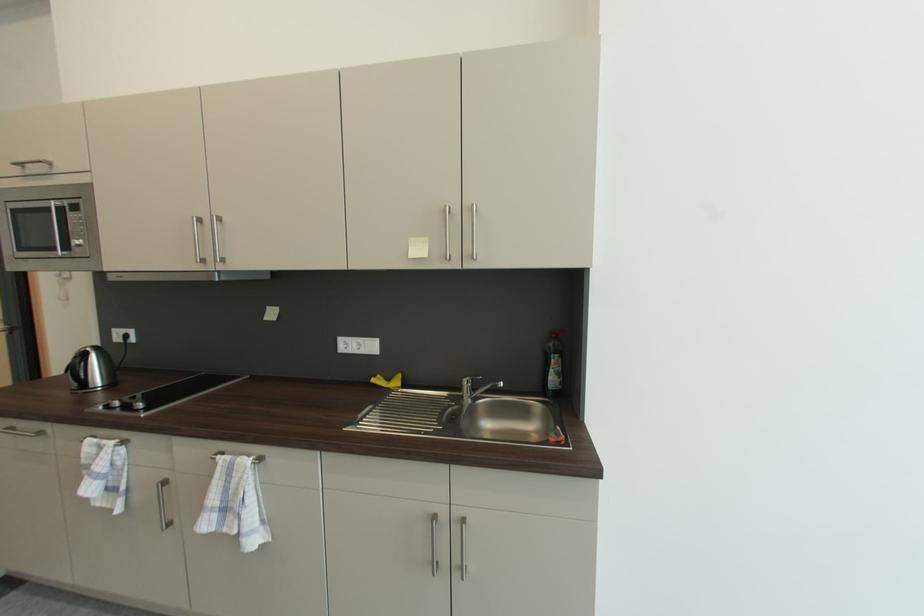
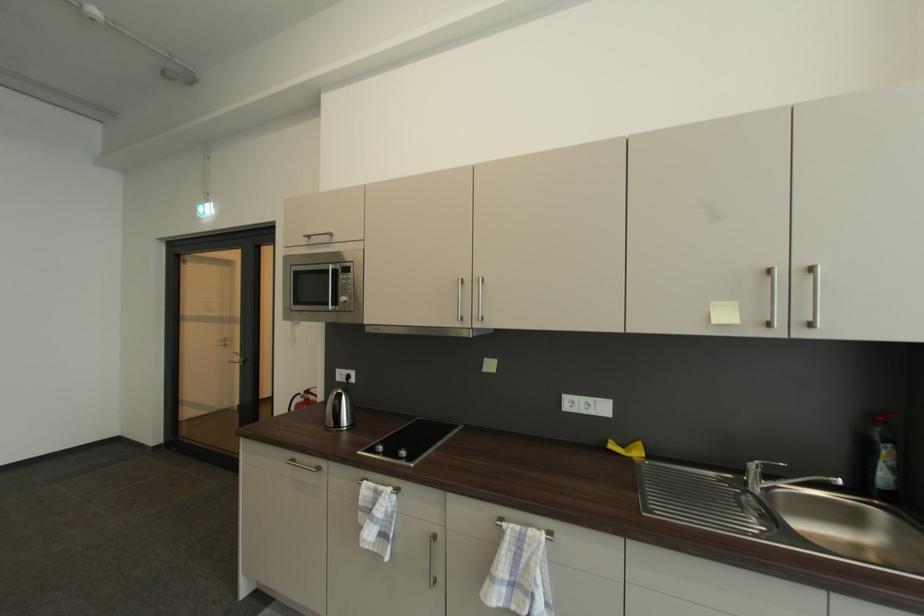
Locate, in the second image, the point that corresponds to (222,461) in the first image.

(507, 529)